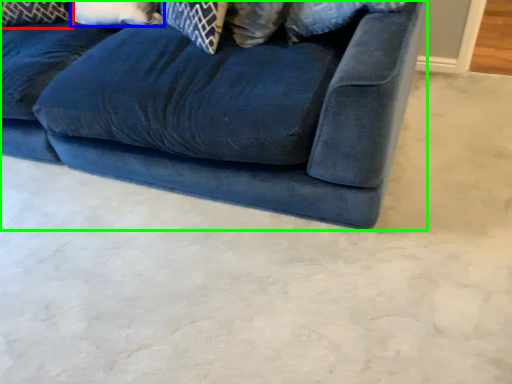
Question: Considering the real-world distances, which object is closest to pillow (highlighted by a red box)? pillow (highlighted by a blue box) or studio couch (highlighted by a green box).

Choices:
 (A) pillow
 (B) studio couch

Answer: (A)